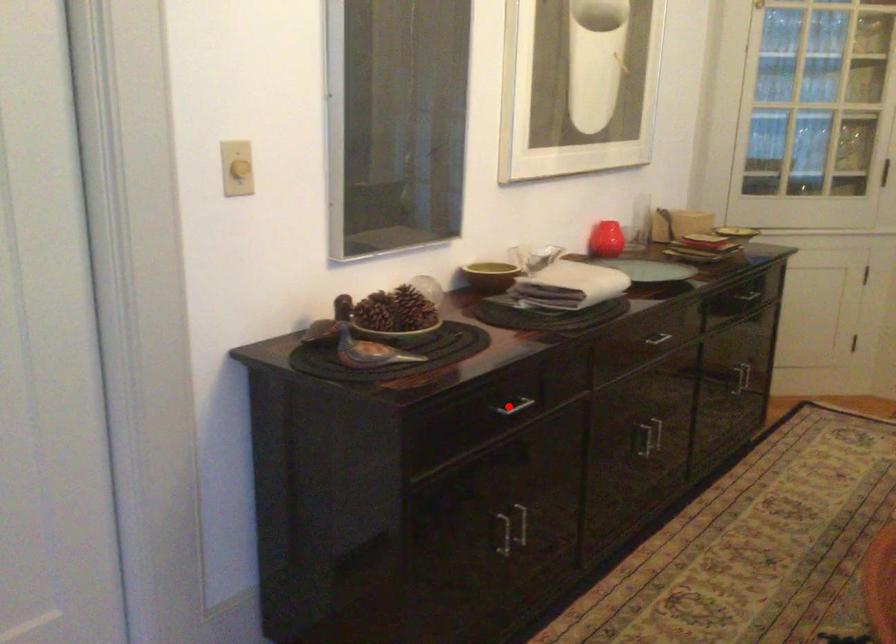
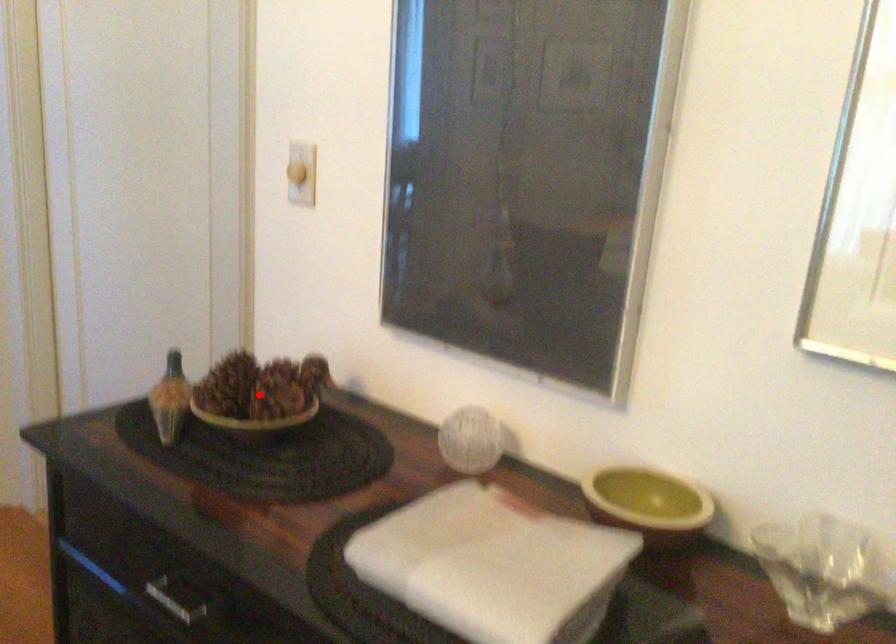
I am providing you with two images of the same scene from different viewpoints. A red point is marked on the first image and another point is marked on the second image. Are the points marked in image1 and image2 representing the same 3D position?

No